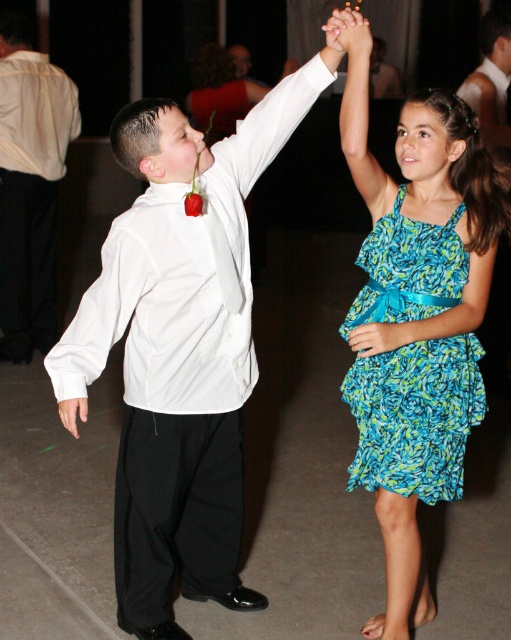
You are a photographer at the event and need to position yourself so that both the white satin shirt at upper left and the white satin shirt at upper center are visible in your frame. Based on their positions, which direction should you face to ensure both are in your shot?

To capture both the white satin shirt at upper left and the white satin shirt at upper center in your frame, you should face towards the center of the scene since the white satin shirt at upper left is positioned to the left of the white satin shirt at upper center.

Consider the image. You are a photographer at the event and want to capture a photo of both the blue floral chiffon dress at center and the white satin shirt at left. Based on their positions, which one is located to the right side?

The blue floral chiffon dress at center is positioned on the right side of the white satin shirt at left.

You are a photographer at the event and want to capture both the blue floral chiffon dress at center and the white satin shirt at left in a single frame. Which object should you focus on to ensure both are visible without cropping?

The blue floral chiffon dress at center occupies less space than the white satin shirt at left, so focusing on the larger white satin shirt at left would allow both objects to fit within the frame.